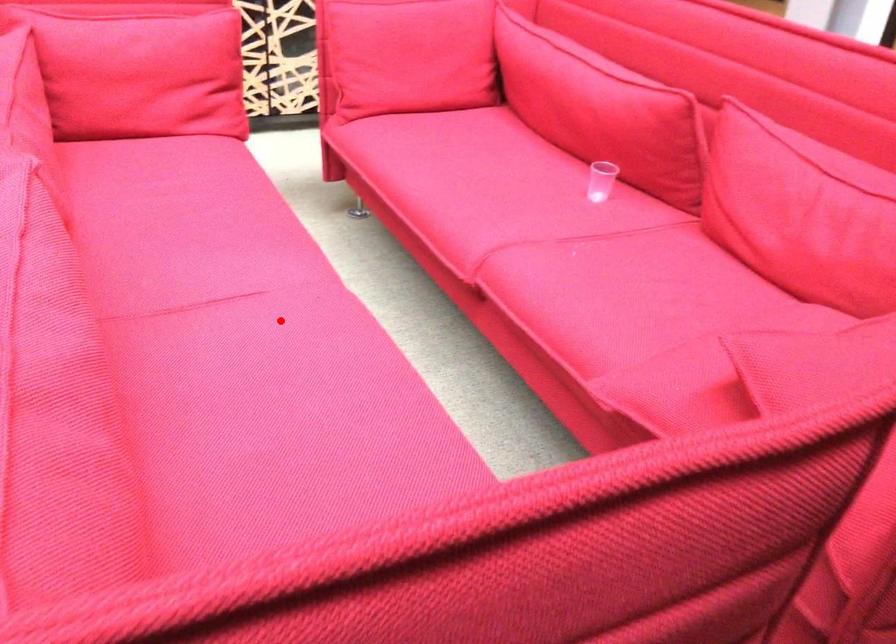
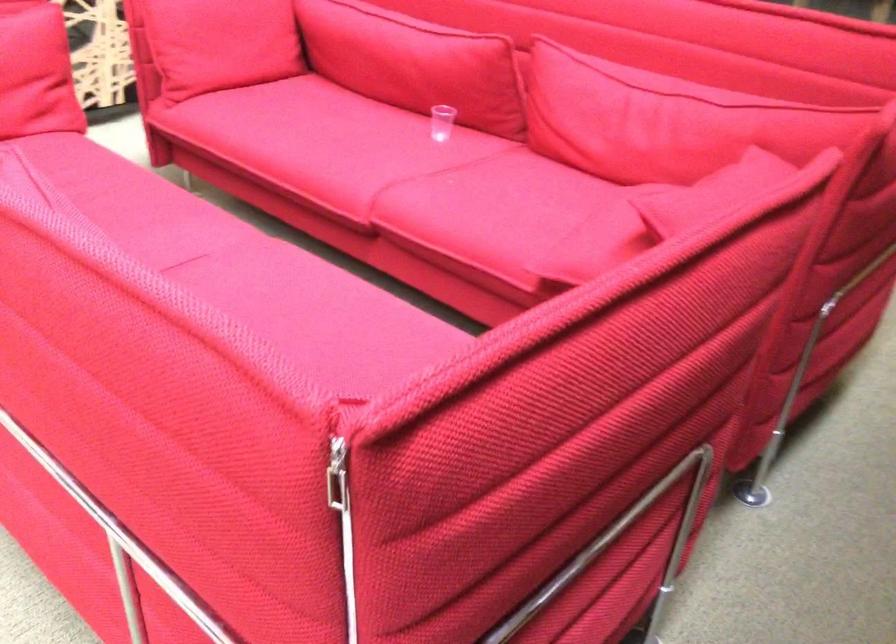
Question: I am providing you with two images of the same scene from different viewpoints. In image1, a red point is highlighted. Considering the same 3D point in image2, which of the following is correct?

Choices:
 (A) It is closer
 (B) It is farther

Answer: (B)